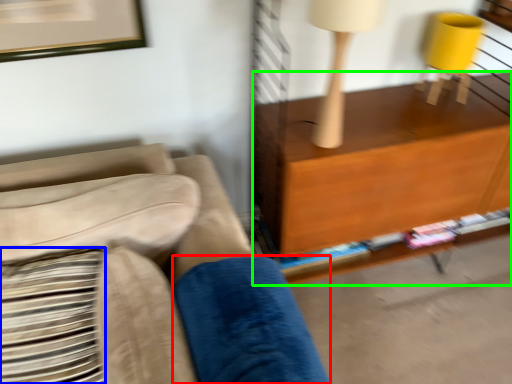
Question: Which object is positioned farthest from pillow (highlighted by a red box)? Select from pillow (highlighted by a blue box) and shelf (highlighted by a green box).

Choices:
 (A) pillow
 (B) shelf

Answer: (B)